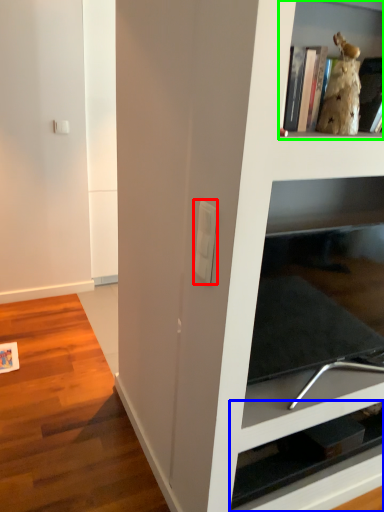
Question: Based on their relative distances, which object is nearer to light switch (highlighted by a red box)? Choose from shelf (highlighted by a blue box) and shelf (highlighted by a green box).

Choices:
 (A) shelf
 (B) shelf

Answer: (B)